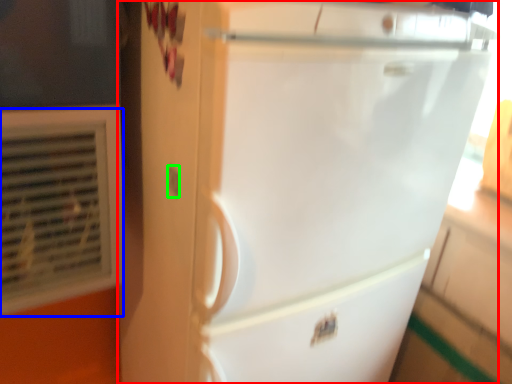
Question: Considering the real-world distances, which object is farthest from refrigerator (highlighted by a red box)? air conditioning (highlighted by a blue box) or electric outlet (highlighted by a green box)?

Choices:
 (A) air conditioning
 (B) electric outlet

Answer: (B)